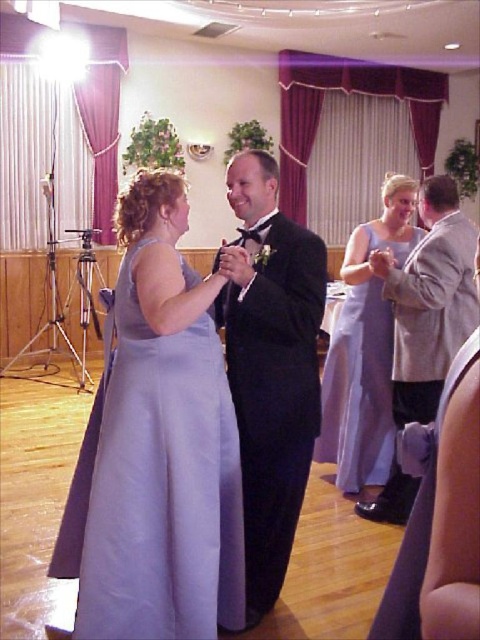
Question: Does lavender satin dress at center appear under black satin tuxedo at center?

Choices:
 (A) yes
 (B) no

Answer: (A)

Question: Based on their relative distances, which object is nearer to the lavender satin dress at center?

Choices:
 (A) gray wool suit at right
 (B) lavender satin dress at right

Answer: (B)

Question: Which object is positioned closest to the black satin tuxedo at center?

Choices:
 (A) gray wool suit at right
 (B) lavender satin dress at center
 (C) lavender satin dress at right

Answer: (B)

Question: Does black satin tuxedo at center have a smaller size compared to gray wool suit at right?

Choices:
 (A) yes
 (B) no

Answer: (B)

Question: Which object appears farthest from the camera in this image?

Choices:
 (A) lavender satin dress at center
 (B) gray wool suit at right
 (C) lavender satin dress at right

Answer: (C)

Question: Does lavender satin dress at center have a larger size compared to black satin tuxedo at center?

Choices:
 (A) yes
 (B) no

Answer: (A)